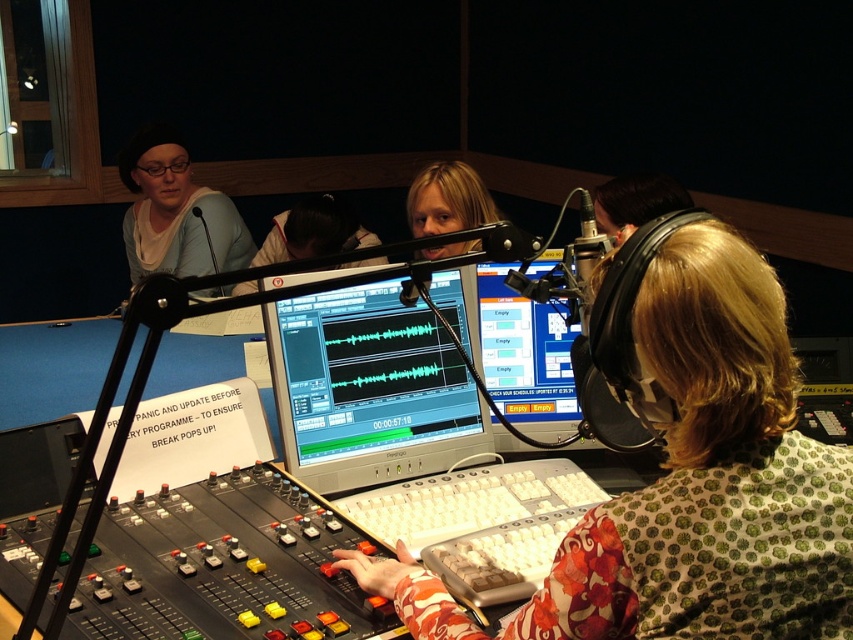
You are a technician in the studio and need to adjust the settings on the silver metallic monitor at center. However, you notice the matte black shirt at upper left is partially blocking your view. Based on their sizes, which object is easier to move to gain a clear view of the monitor?

The silver metallic monitor at center is smaller than the matte black shirt at upper left, so it would be easier to move the matte black shirt at upper left to gain a clear view of the monitor.

You are a technician in the studio and need to adjust the settings on the matte black monitor at center and the matte black headphones at upper right. Which device is taller?

The matte black monitor at center is much taller than the matte black headphones at upper right.